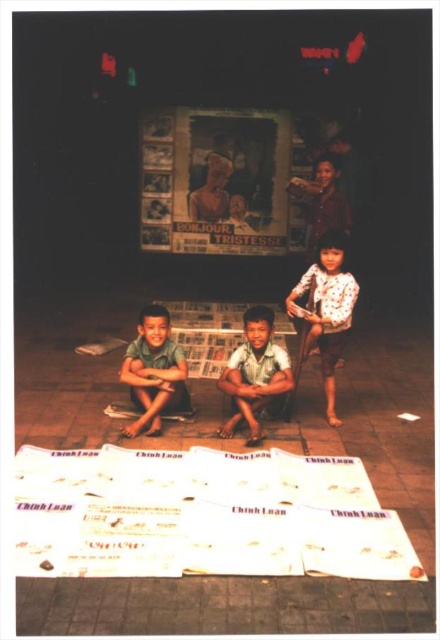
In the scene shown: You are a photographer trying to capture a candid shot of the two subjects in the scene. The matte green shorts at center and the light brown fabric boy at center are both in your frame. Based on their positions, which one is positioned to the left side of the frame?

The matte green shorts at center is to the left of light brown fabric boy at center, so the matte green shorts at center is positioned to the left side of the frame.

You are a photographer in the scene and want to take a picture of the white cotton shirt at right and the matte green shorts at center. Which object should you focus on first if you want to capture both clearly in the same frame?

The white cotton shirt at right is located above the matte green shorts at center, so you should focus on the matte green shorts at center first since it is closer to the camera. This will ensure both objects are in focus as the depth of field will cover the distance between them.

You are a photographer standing at the center of the room. You want to take a photo of the white cotton shirt at right. Where should you aim your camera to capture it in the frame?

→ You should aim your camera at point (326, 310) to capture the white cotton shirt at right in the frame.